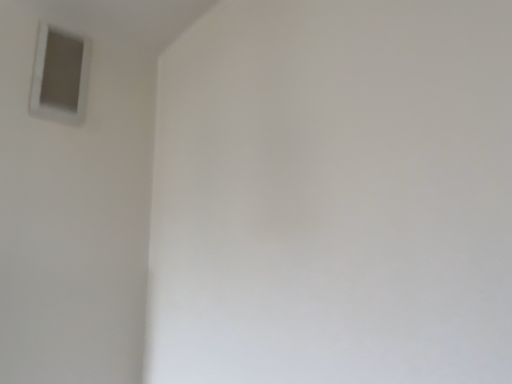
In order to face white matte window at upper left, should I rotate leftwards or rightwards?

Turn left approximately 24.376 degrees to face it.

What do you see at coordinates (60, 76) in the screenshot? The width and height of the screenshot is (512, 384). I see `white matte window at upper left` at bounding box center [60, 76].

I want to click on white matte window at upper left, so click(x=60, y=76).

This screenshot has width=512, height=384. What are the coordinates of `white matte window at upper left` in the screenshot? It's located at (60, 76).